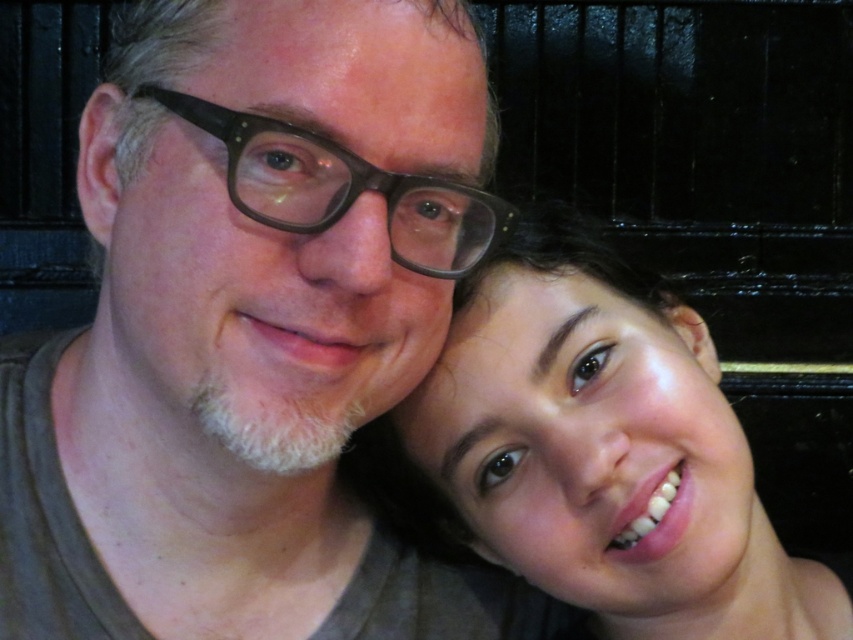
You are taking a photo of two people in the scene. You want to place a sticker exactly halfway between point (193, 467) and point (498, 202). Will the sticker be closer to the people or the background?

The sticker placed halfway between point (193, 467) and point (498, 202) will be closer to the people because point (193, 467) is closer to the viewer than point (498, 202).

Looking at the two people in the photo, where is the matte brown hair at center compared to the matte brown glasses at center?

The matte brown hair at center is to the left of the matte brown glasses at center.

Based on the scene, which object is wider, the matte brown hair at center or the matte brown glasses at center?

The matte brown hair at center is wider than the matte brown glasses at center according to the description.